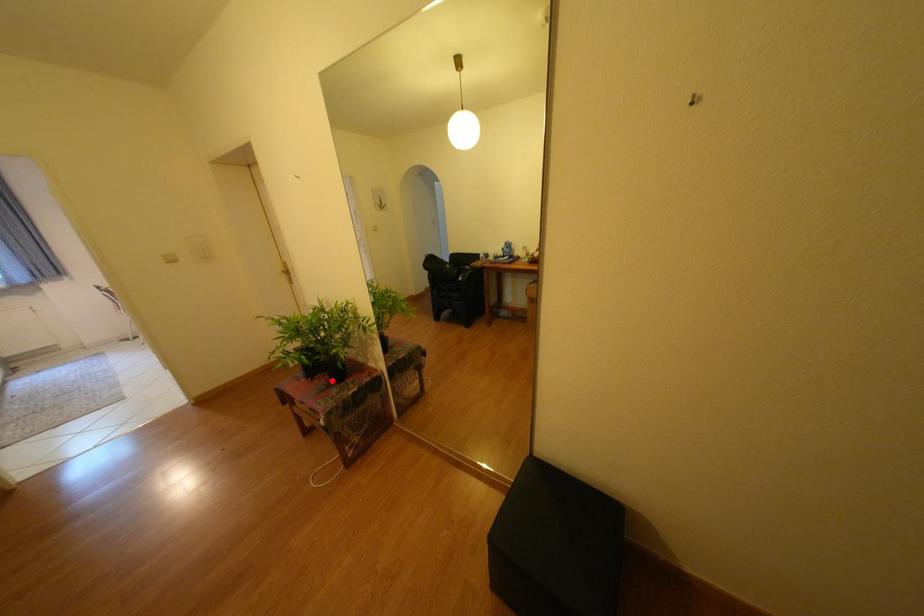
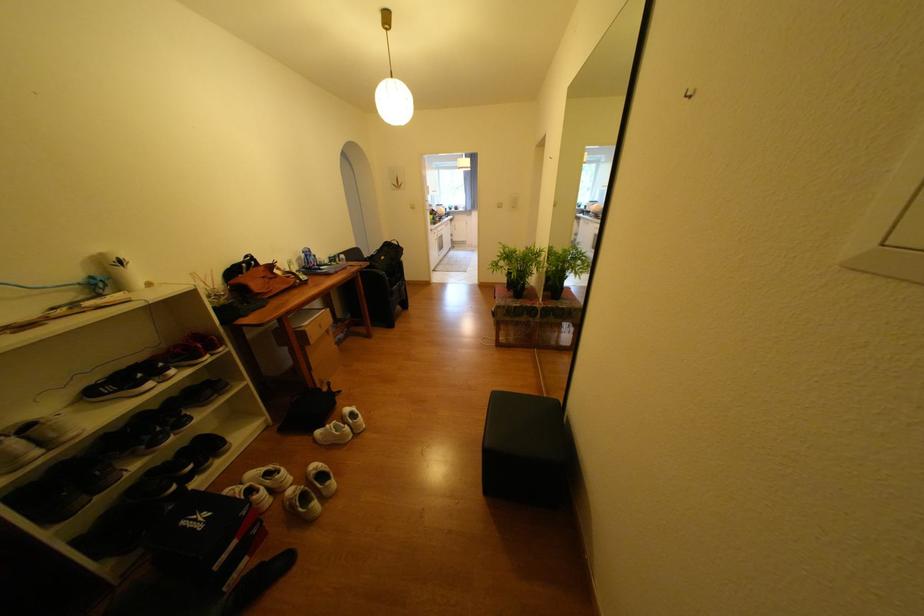
Locate, in the second image, the point that corresponds to the highlighted location in the first image.

(520, 294)